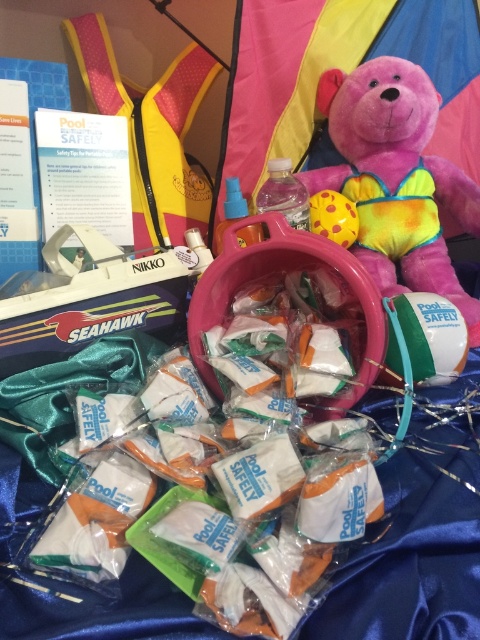
The height and width of the screenshot is (640, 480). Describe the element at coordinates (432, 337) in the screenshot. I see `white plastic bucket at center` at that location.

Who is more forward, (384, 371) or (343, 218)?

Positioned in front is point (384, 371).

Where is `white plastic bucket at center`? The image size is (480, 640). white plastic bucket at center is located at coordinates (432, 337).

Is pink plush bear at center positioned in front of white plastic bucket at center?

No, it is not.

At what (x,y) coordinates should I click in order to perform the action: click on pink plush bear at center. Please return your answer as a coordinate pair (x, y). This screenshot has width=480, height=640. Looking at the image, I should click on (396, 177).

Which of these two, pink plush bear at center or yellow rubber ball at center, stands taller?

pink plush bear at center is taller.

Can you confirm if pink plush bear at center is shorter than yellow rubber ball at center?

Incorrect, pink plush bear at center's height does not fall short of yellow rubber ball at center's.

Who is more distant from viewer, (420, 204) or (354, 240)?

Positioned behind is point (420, 204).

Locate an element on the screen. pink plush bear at center is located at coordinates (396, 177).